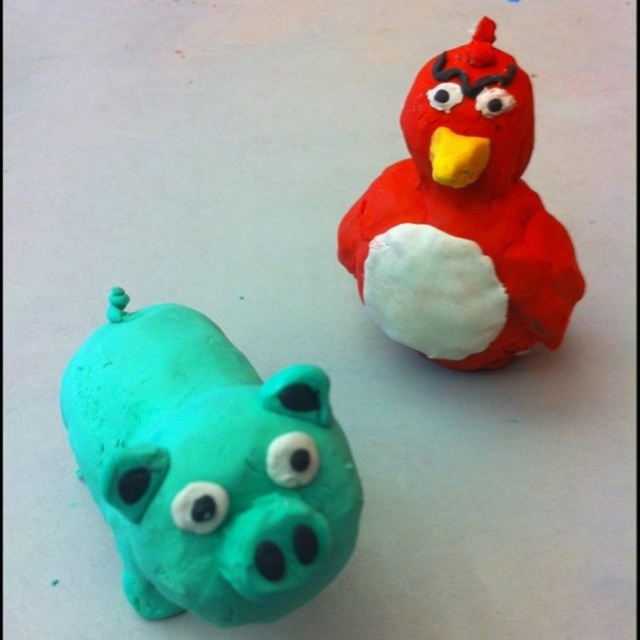
Question: Is teal clay pig at lower left bigger than matte red clay bird at upper right?

Choices:
 (A) yes
 (B) no

Answer: (A)

Question: In this image, where is teal clay pig at lower left located relative to matte red clay bird at upper right?

Choices:
 (A) right
 (B) left

Answer: (B)

Question: Among these points, which one is farthest from the camera?

Choices:
 (A) (257, 577)
 (B) (461, 316)

Answer: (B)

Question: Which point is farther to the camera?

Choices:
 (A) (310, 548)
 (B) (493, 150)

Answer: (B)

Question: Does teal clay pig at lower left appear under matte red clay bird at upper right?

Choices:
 (A) no
 (B) yes

Answer: (B)